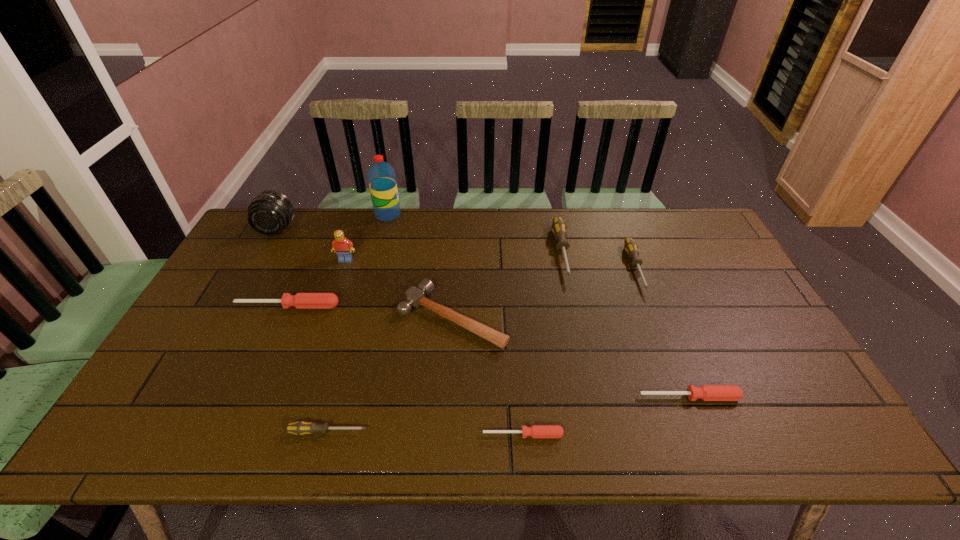
At what (x,y) coordinates should I click in order to perform the action: click on object positioned at the far left corner. Please return your answer as a coordinate pair (x, y). Image resolution: width=960 pixels, height=540 pixels. Looking at the image, I should click on (269, 213).

Where is `free space at the far edge`? free space at the far edge is located at coordinates (521, 241).

In the image, there is a desktop. Where is `vacant region at the near edge`? This screenshot has height=540, width=960. vacant region at the near edge is located at coordinates (x=594, y=440).

In the image, there is a desktop. Where is `free region at the left edge`? The height and width of the screenshot is (540, 960). free region at the left edge is located at coordinates (267, 255).

Image resolution: width=960 pixels, height=540 pixels. In the image, there is a desktop. In order to click on vacant region at the near left corner in this screenshot , I will do `click(116, 447)`.

You are a GUI agent. You are given a task and a screenshot of the screen. Output one action in this format:
    pyautogui.click(x=<x>, y=<y>)
    Task: Click on the free space at the far right corner of the desktop
    This screenshot has height=540, width=960.
    Given the screenshot: What is the action you would take?
    pyautogui.click(x=673, y=233)

You are a GUI agent. You are given a task and a screenshot of the screen. Output one action in this format:
    pyautogui.click(x=<x>, y=<y>)
    Task: Click on the free space between the smallest red screwdriver and the hammer
    The width and height of the screenshot is (960, 540).
    Given the screenshot: What is the action you would take?
    pyautogui.click(x=488, y=376)

Find the location of a particular element. The height and width of the screenshot is (540, 960). vacant space in between the hammer and the eighth shortest object is located at coordinates (399, 288).

The image size is (960, 540). I want to click on vacant point located between the tallest screwdriver and the telephoto lens, so click(420, 241).

Find the location of a particular element. Image resolution: width=960 pixels, height=540 pixels. unoccupied area between the farthest red screwdriver and the tallest object is located at coordinates (338, 260).